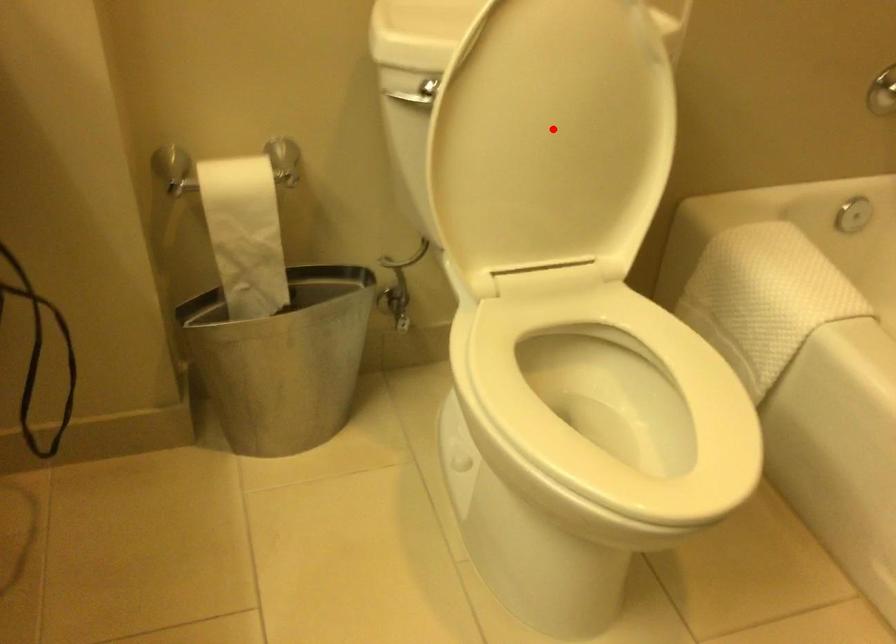
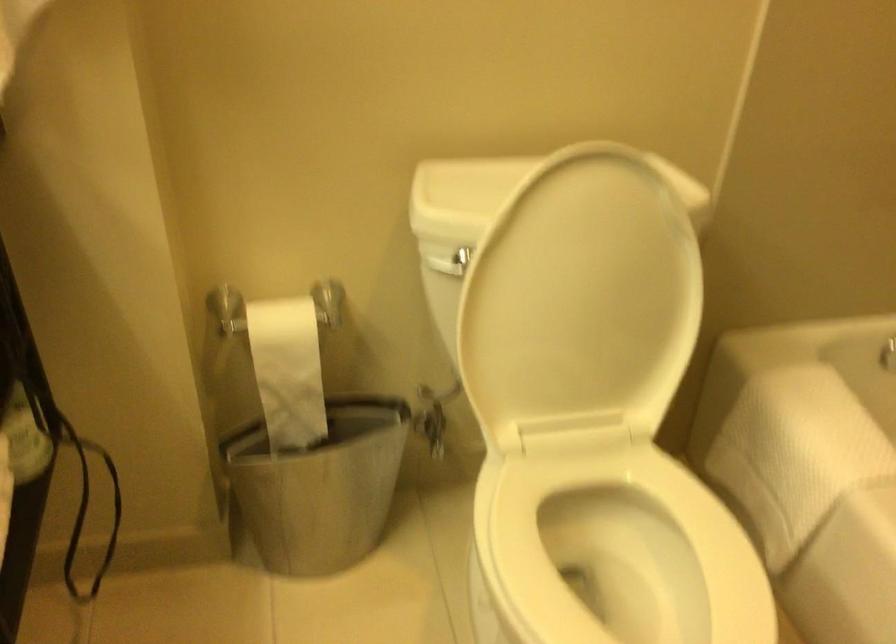
Where in the second image is the point corresponding to the highlighted location from the first image?

(581, 301)